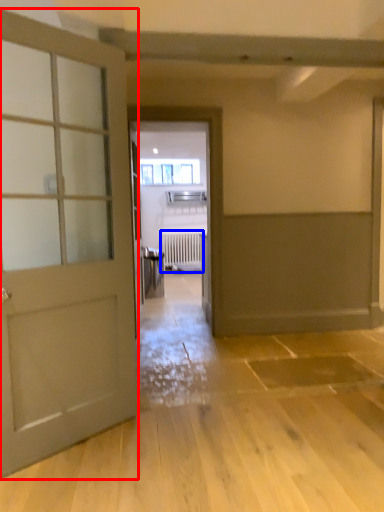
Question: Which point is closer to the camera, door (highlighted by a red box) or radiator (highlighted by a blue box)?

Choices:
 (A) door
 (B) radiator

Answer: (A)